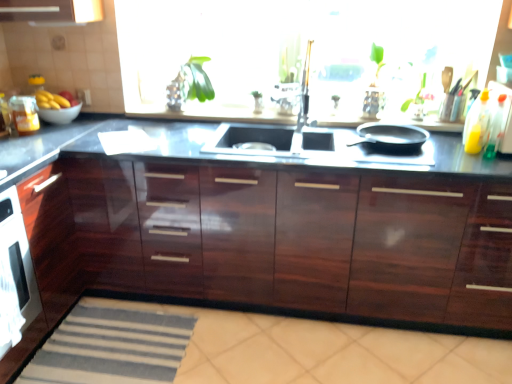
Describe the element at coordinates (51, 100) in the screenshot. Image resolution: width=512 pixels, height=384 pixels. I see `yellow matte bananas at left` at that location.

Image resolution: width=512 pixels, height=384 pixels. What do you see at coordinates (476, 124) in the screenshot?
I see `translucent plastic bottle at right, the first bottle when ordered from back to front` at bounding box center [476, 124].

Locate an element on the screen. The image size is (512, 384). white glossy bowl at upper left is located at coordinates (59, 114).

In order to face black matte frying pan at right, should I rotate leftwards or rightwards?

To face it directly, rotate right by 17.065 degrees.

What do you see at coordinates (391, 137) in the screenshot? I see `black matte frying pan at right` at bounding box center [391, 137].

At what (x,y) coordinates should I click in order to perform the action: click on yellow matte bananas at left. Please return your answer as a coordinate pair (x, y). This screenshot has height=384, width=512. Looking at the image, I should click on (51, 100).

From the image's perspective, which is above, transparent glass window at center or yellow matte bananas at left?

transparent glass window at center.

From a real-world perspective, who is located higher, transparent glass window at center or yellow matte bananas at left?

transparent glass window at center.

Which is more to the left, transparent glass window at center or yellow matte bananas at left?

Positioned to the left is yellow matte bananas at left.

Are translucent plastic bottle at right, the first bottle when ordered from back to front, and yellow matte bananas at left located far from each other?

That's right, there is a large distance between translucent plastic bottle at right, the first bottle when ordered from back to front, and yellow matte bananas at left.

Which is behind, translucent plastic bottle at right, the first bottle when ordered from back to front, or yellow matte bananas at left?

yellow matte bananas at left.

Between point (477, 132) and point (47, 108), which one is positioned behind?

The point (47, 108) is farther from the camera.

Considering the relative positions of translucent plastic bottle at right, the first bottle when ordered from back to front, and yellow matte bananas at left in the image provided, is translucent plastic bottle at right, the first bottle when ordered from back to front, to the left of yellow matte bananas at left from the viewer's perspective?

In fact, translucent plastic bottle at right, the first bottle when ordered from back to front, is to the right of yellow matte bananas at left.

Which object is wider, white glossy bowl at upper left or glossy black countertop at center?

With larger width is glossy black countertop at center.

Is white glossy bowl at upper left far away from glossy black countertop at center?

Indeed, white glossy bowl at upper left is not near glossy black countertop at center.

Would you say white glossy bowl at upper left is inside or outside glossy black countertop at center?

white glossy bowl at upper left cannot be found inside glossy black countertop at center.

Is white glossy bowl at upper left further to the viewer compared to glossy black countertop at center?

Yes, white glossy bowl at upper left is behind glossy black countertop at center.

Is translucent plastic bottle at right, the first bottle when ordered from back to front, facing towards black matte frying pan at right?

No, translucent plastic bottle at right, the first bottle when ordered from back to front, is not facing towards black matte frying pan at right.

Would you say translucent plastic bottle at right, the first bottle when ordered from back to front, is to the left or to the right of black matte frying pan at right in the picture?

From the image, it's evident that translucent plastic bottle at right, the first bottle when ordered from back to front, is to the right of black matte frying pan at right.

Would you consider translucent plastic bottle at right, positioned as the second bottle in front-to-back order, to be distant from black matte frying pan at right?

No, translucent plastic bottle at right, positioned as the second bottle in front-to-back order, is in close proximity to black matte frying pan at right.

What's the angular difference between translucent plastic bottle at right, the first bottle when ordered from back to front, and black matte frying pan at right's facing directions?

5.3 degrees separate the facing orientations of translucent plastic bottle at right, the first bottle when ordered from back to front, and black matte frying pan at right.

In the scene shown: Is white glossy bowl at upper left aimed at transparent glass window at center?

No, white glossy bowl at upper left is not aimed at transparent glass window at center.

Which object is closer to the camera, white glossy bowl at upper left or transparent glass window at center?

Positioned in front is transparent glass window at center.

From a real-world perspective, who is located higher, white glossy bowl at upper left or transparent glass window at center?

transparent glass window at center, from a real-world perspective.

Is white glossy bowl at upper left not near transparent glass window at center?

white glossy bowl at upper left is far away from transparent glass window at center.

From a real-world perspective, which is physically below, yellow matte bananas at left or translucent plastic bottle at right, the second bottle viewed from the back?

In real-world perspective, yellow matte bananas at left is lower.

Is yellow matte bananas at left not inside translucent plastic bottle at right, the second bottle viewed from the back?

Absolutely, yellow matte bananas at left is external to translucent plastic bottle at right, the second bottle viewed from the back.

Which object is positioned more to the right, yellow matte bananas at left or translucent plastic bottle at right, the second bottle viewed from the back?

translucent plastic bottle at right, the second bottle viewed from the back, is more to the right.

Based on the photo, between yellow matte bananas at left and translucent plastic bottle at right, which is counted as the 1th bottle, starting from the front, which one is positioned in front?

translucent plastic bottle at right, which is counted as the 1th bottle, starting from the front, is more forward.

Does point (365, 182) come farther from viewer compared to point (472, 105)?

No, (365, 182) is in front of (472, 105).

Is glossy black countertop at center thinner than translucent plastic bottle at right, the first bottle when ordered from back to front?

Incorrect, the width of glossy black countertop at center is not less than that of translucent plastic bottle at right, the first bottle when ordered from back to front.

Is glossy black countertop at center in front of or behind translucent plastic bottle at right, the first bottle when ordered from back to front, in the image?

Clearly, glossy black countertop at center is in front of translucent plastic bottle at right, the first bottle when ordered from back to front.

From the picture: Does glossy black countertop at center appear on the right side of translucent plastic bottle at right, positioned as the second bottle in front-to-back order?

In fact, glossy black countertop at center is to the left of translucent plastic bottle at right, positioned as the second bottle in front-to-back order.

The height and width of the screenshot is (384, 512). Identify the location of window screen above the yellow matte bananas at left (from a real-world perspective). (298, 49).

Locate an element on the screen. The height and width of the screenshot is (384, 512). fruit behind the translucent plastic bottle at right, the first bottle when ordered from back to front is located at coordinates (51, 100).

From the image, which object appears to be nearer to yellow matte bananas at left, black matte frying pan at right or translucent plastic bottle at right, positioned as the second bottle in front-to-back order?

Based on the image, black matte frying pan at right appears to be nearer to yellow matte bananas at left.

Which object lies further to the anchor point translucent plastic bottle at right, which is counted as the 1th bottle, starting from the front, glossy black countertop at center or translucent plastic bottle at right, the first bottle when ordered from back to front?

Based on the image, glossy black countertop at center appears to be further to translucent plastic bottle at right, which is counted as the 1th bottle, starting from the front.

When comparing their distances from transparent glass window at center, does glossy black countertop at center or white glossy bowl at upper left seem closer?

glossy black countertop at center lies closer to transparent glass window at center than the other object.

Which object lies nearer to the anchor point translucent plastic bottle at right, which is counted as the 1th bottle, starting from the front, black matte frying pan at right or white glossy bowl at upper left?

black matte frying pan at right lies closer to translucent plastic bottle at right, which is counted as the 1th bottle, starting from the front, than the other object.

From the picture: Estimate the real-world distances between objects in this image. Which object is closer to transparent glass window at center, translucent plastic bottle at right, the first bottle when ordered from back to front, or translucent plastic bottle at right, which is counted as the 1th bottle, starting from the front?

translucent plastic bottle at right, the first bottle when ordered from back to front.

From the image, which object appears to be nearer to black matte frying pan at right, yellow matte bananas at left or translucent plastic bottle at right, positioned as the second bottle in front-to-back order?

Among the two, translucent plastic bottle at right, positioned as the second bottle in front-to-back order, is located nearer to black matte frying pan at right.

Which object lies nearer to the anchor point black matte frying pan at right, glossy black countertop at center or translucent plastic bottle at right, the second bottle viewed from the back?

translucent plastic bottle at right, the second bottle viewed from the back, is closer to black matte frying pan at right.

From the image, which object appears to be nearer to white glossy bowl at upper left, translucent plastic bottle at right, positioned as the second bottle in front-to-back order, or black matte frying pan at right?

black matte frying pan at right.

I want to click on frying pan between yellow matte bananas at left and translucent plastic bottle at right, which is counted as the 1th bottle, starting from the front, so click(x=391, y=137).

You are a GUI agent. You are given a task and a screenshot of the screen. Output one action in this format:
    pyautogui.click(x=<x>, y=<y>)
    Task: Click on the frying pan between transparent glass window at center and translucent plastic bottle at right, the first bottle when ordered from back to front, from left to right
    
    Given the screenshot: What is the action you would take?
    pyautogui.click(x=391, y=137)

Image resolution: width=512 pixels, height=384 pixels. What are the coordinates of `frying pan situated between white glossy bowl at upper left and translucent plastic bottle at right, positioned as the second bottle in front-to-back order, from left to right` in the screenshot? It's located at (391, 137).

This screenshot has height=384, width=512. Identify the location of bottle situated between transparent glass window at center and translucent plastic bottle at right, the second bottle viewed from the back, from left to right. (476, 124).